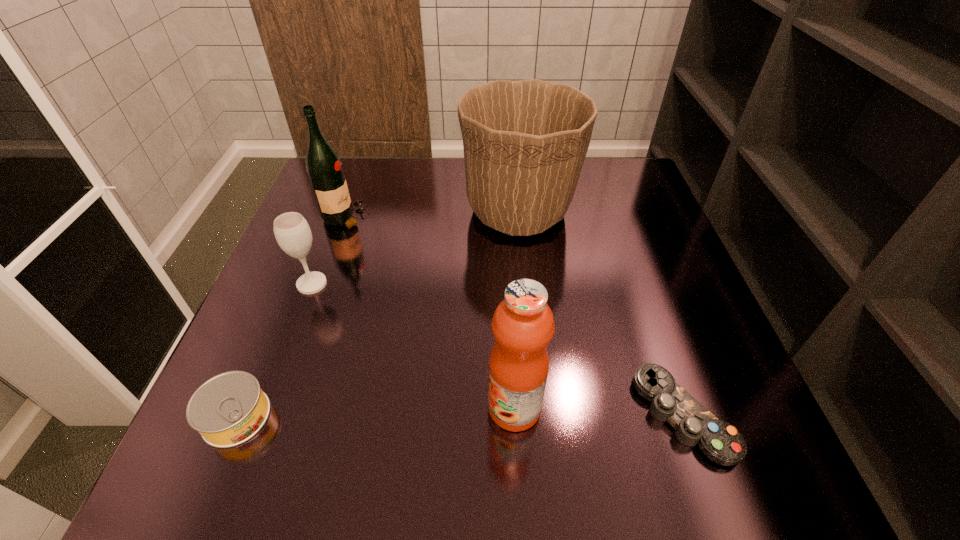
Where is `flowerpot`? flowerpot is located at coordinates (525, 142).

Identify the location of wine bottle. (324, 168).

At what (x,y) coordinates should I click in order to perform the action: click on fruit juice. Please return your answer as a coordinate pair (x, y). Looking at the image, I should click on (523, 325).

This screenshot has height=540, width=960. Find the location of `the third farthest object`. the third farthest object is located at coordinates (292, 232).

You are a GUI agent. You are given a task and a screenshot of the screen. Output one action in this format:
    pyautogui.click(x=<x>, y=<y>)
    Task: Click on the wineglass
    
    Given the screenshot: What is the action you would take?
    pyautogui.click(x=292, y=232)

You are a GUI agent. You are given a task and a screenshot of the screen. Output one action in this format:
    pyautogui.click(x=<x>, y=<y>)
    Task: Click on the can
    The image size is (960, 540).
    Given the screenshot: What is the action you would take?
    pyautogui.click(x=230, y=408)

You are a GUI agent. You are given a task and a screenshot of the screen. Output one action in this format:
    pyautogui.click(x=<x>, y=<y>)
    Task: Click on the control
    
    Given the screenshot: What is the action you would take?
    pyautogui.click(x=721, y=442)

Where is `the rightmost object`? the rightmost object is located at coordinates (721, 442).

In order to click on blank area located 0.220m on the left of the flowerpot in this screenshot , I will do `click(376, 211)`.

Where is `free location located on the front of the wine bottle`? free location located on the front of the wine bottle is located at coordinates (296, 355).